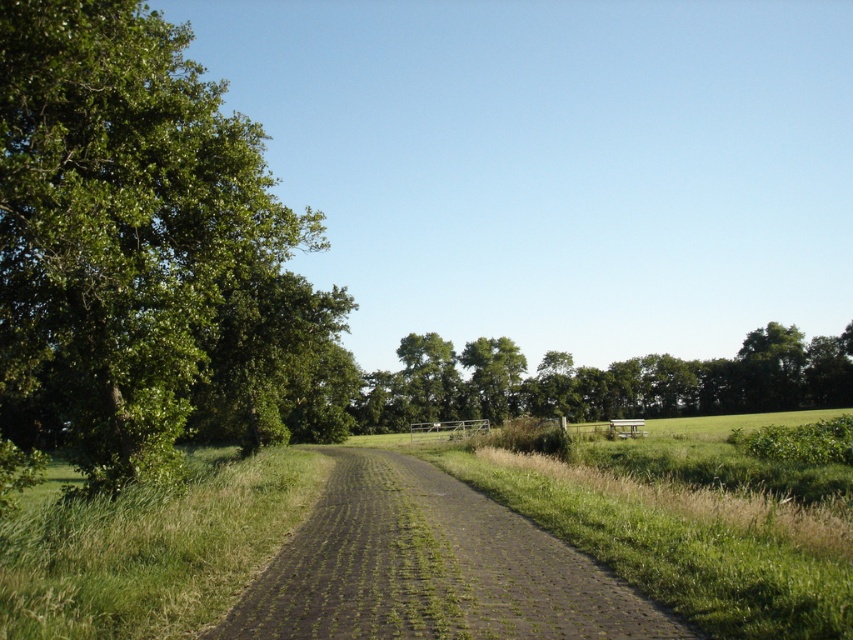
You are standing at the center of the paved path in the rural landscape. Looking towards the green leafy tree at left, in which direction relative to your position is the tree located?

The green leafy tree at left is located to the left side of your position, as indicated by its 2D coordinates at point (x=148, y=256).

You are standing at the center of the path in the rural landscape. Which direction should you walk to reach the green leafy tree at left?

The green leafy tree at left is located at the left side of the path, so you should walk to your left to reach it.